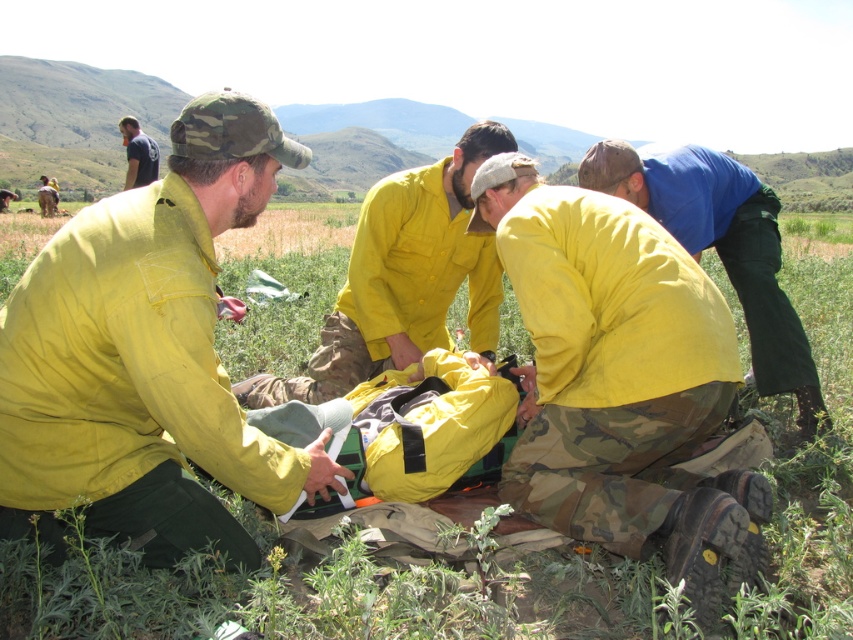
Question: Which object is farther from the camera taking this photo?

Choices:
 (A) matte yellow jacket at left
 (B) blue cotton shirt at upper right

Answer: (B)

Question: Can you confirm if matte yellow jacket at left is positioned above yellow matte uniform at center?

Choices:
 (A) no
 (B) yes

Answer: (A)

Question: Where is yellow matte uniform at center located in relation to blue cotton shirt at upper right in the image?

Choices:
 (A) right
 (B) left

Answer: (B)

Question: Which of the following is the farthest from the observer?

Choices:
 (A) matte yellow jacket at left
 (B) yellow matte jacket at center
 (C) yellow matte uniform at center
 (D) blue cotton shirt at upper right

Answer: (D)

Question: Which point is closer to the camera?

Choices:
 (A) matte yellow jacket at left
 (B) yellow matte jacket at center
 (C) blue cotton shirt at upper right
 (D) dark blue shirt at upper left

Answer: (A)

Question: Does yellow matte jacket at center appear on the left side of blue cotton shirt at upper right?

Choices:
 (A) yes
 (B) no

Answer: (A)